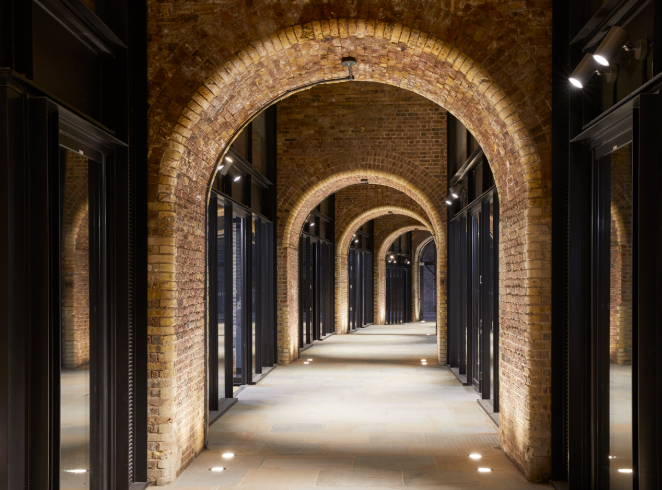
Where is `tiles`? This screenshot has width=662, height=490. tiles is located at coordinates (277, 480), (287, 461), (386, 459), (387, 476), (432, 478).